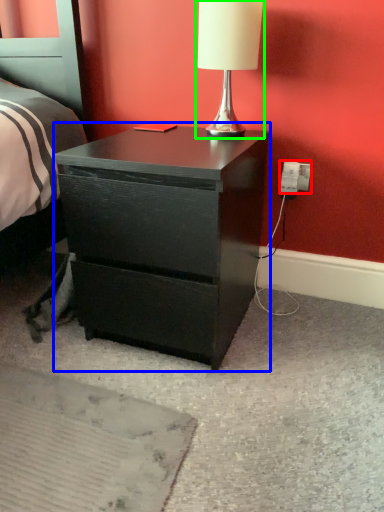
Question: Estimate the real-world distances between objects in this image. Which object is closer to electric outlet (highlighted by a red box), nightstand (highlighted by a blue box) or table lamp (highlighted by a green box)?

Choices:
 (A) nightstand
 (B) table lamp

Answer: (B)